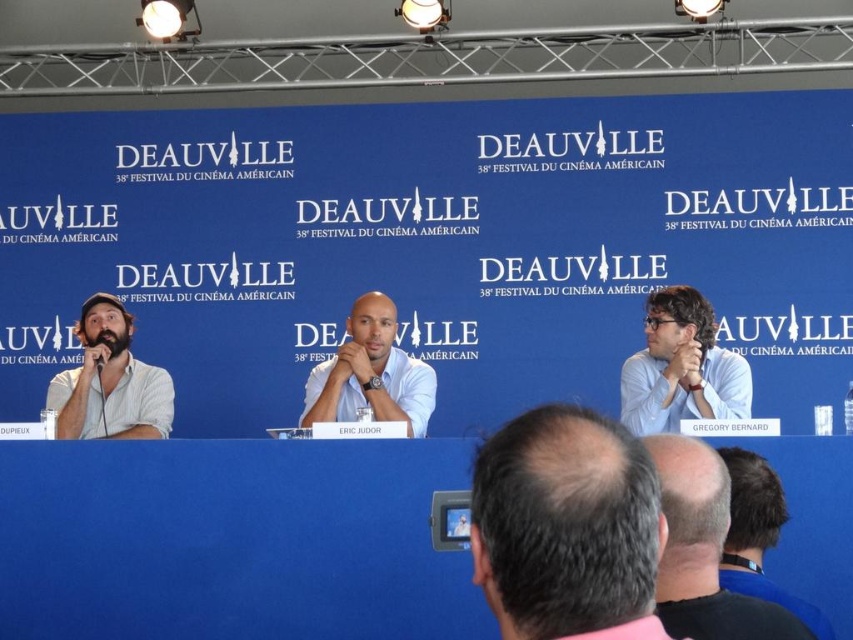
Question: Does matte gray shirt at right appear under smooth white shirt at center?

Choices:
 (A) yes
 (B) no

Answer: (B)

Question: Can you confirm if gray hair at center is smaller than bearded man at left?

Choices:
 (A) yes
 (B) no

Answer: (B)

Question: Considering the real-world distances, which object is farthest from the smooth white shirt at center?

Choices:
 (A) blue matte table at center
 (B) gray hair at center
 (C) dark brown hair at lower right
 (D) dark blue shirt at lower right

Answer: (D)

Question: Does smooth white shirt at center have a larger size compared to dark blue shirt at lower right?

Choices:
 (A) yes
 (B) no

Answer: (A)

Question: Estimate the real-world distances between objects in this image. Which object is closer to the matte gray shirt at right?

Choices:
 (A) bearded man at left
 (B) dark blue shirt at lower right
 (C) smooth white shirt at center
 (D) dark brown hair at lower right

Answer: (C)

Question: Considering the real-world distances, which object is closest to the dark brown hair at lower right?

Choices:
 (A) smooth white shirt at center
 (B) bearded man at left
 (C) gray hair at center

Answer: (C)